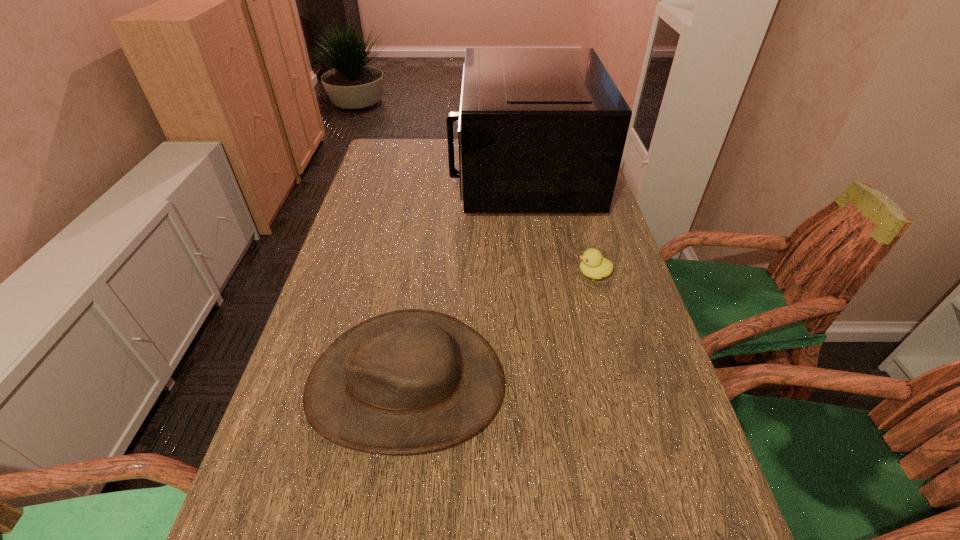
I want to click on the tallest object, so click(541, 130).

At what (x,y) coordinates should I click in order to perform the action: click on the farthest object. Please return your answer as a coordinate pair (x, y). The image size is (960, 540). Looking at the image, I should click on (541, 130).

Locate an element on the screen. cowboy hat is located at coordinates (411, 381).

You are a GUI agent. You are given a task and a screenshot of the screen. Output one action in this format:
    pyautogui.click(x=<x>, y=<y>)
    Task: Click on the second tallest object
    
    Given the screenshot: What is the action you would take?
    pyautogui.click(x=411, y=381)

Image resolution: width=960 pixels, height=540 pixels. Find the location of `duckling`. duckling is located at coordinates (593, 265).

In order to click on the second farthest object in this screenshot , I will do `click(593, 265)`.

Where is `blank space located on the front-facing side of the microwave_oven`? The width and height of the screenshot is (960, 540). blank space located on the front-facing side of the microwave_oven is located at coordinates (397, 174).

The height and width of the screenshot is (540, 960). Find the location of `vacant space situated 0.090m on the front-facing side of the microwave_oven`. vacant space situated 0.090m on the front-facing side of the microwave_oven is located at coordinates (426, 174).

The image size is (960, 540). In order to click on vacant space positioned 0.100m on the front-facing side of the microwave_oven in this screenshot , I will do `click(423, 174)`.

This screenshot has width=960, height=540. I want to click on vacant space located on the back of the cowboy hat, so click(x=421, y=273).